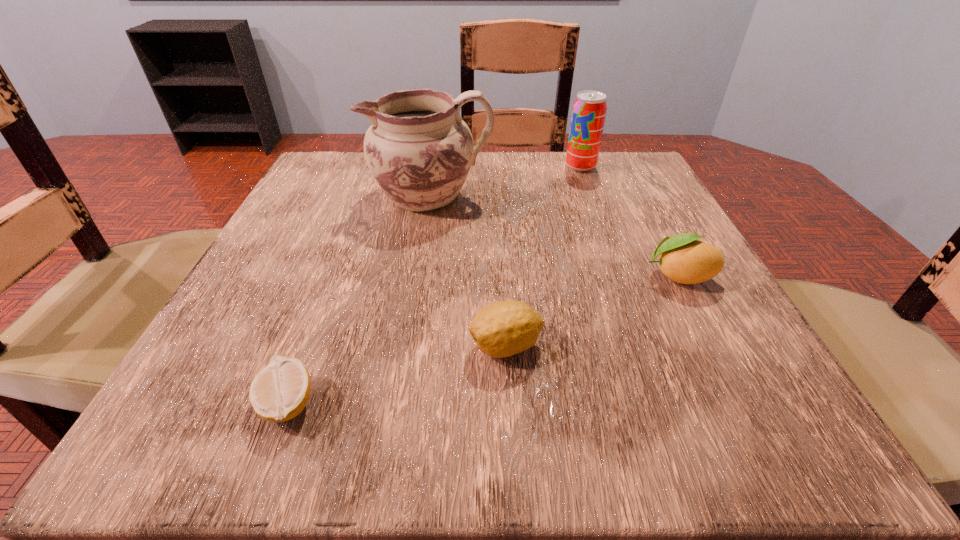
Identify the location of free space located on the spout of the tallest object. (318, 195).

Find the location of `vacant space located on the spout of the tallest object`. vacant space located on the spout of the tallest object is located at coordinates (302, 195).

Identify the location of vacant space situated 0.370m on the left of the second object from right to left. (396, 167).

This screenshot has width=960, height=540. I want to click on free region located with leaves positioned above the farthest lemon, so click(x=405, y=276).

The image size is (960, 540). I want to click on vacant space located 0.160m with leaves positioned above the farthest lemon, so click(x=540, y=276).

Where is `free location located 0.060m with leaves positioned above the farthest lemon`? free location located 0.060m with leaves positioned above the farthest lemon is located at coordinates (604, 276).

In order to click on vacant space situated 0.140m at the stem end of the second farthest lemon in this screenshot , I will do click(x=364, y=346).

The height and width of the screenshot is (540, 960). I want to click on vacant space located 0.230m at the stem end of the second farthest lemon, so click(296, 346).

This screenshot has height=540, width=960. Find the location of `free location located 0.070m at the stem end of the second farthest lemon`. free location located 0.070m at the stem end of the second farthest lemon is located at coordinates (417, 346).

The image size is (960, 540). What are the coordinates of `free space located 0.250m on the back of the nearest lemon` in the screenshot? It's located at (345, 251).